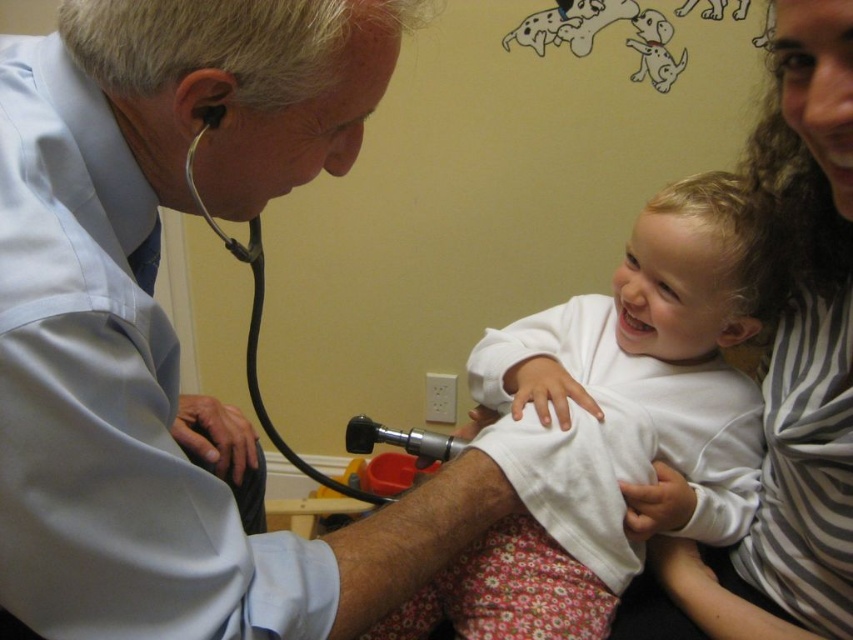
Question: Which point appears closest to the camera in this image?

Choices:
 (A) (840, 385)
 (B) (392, 432)

Answer: (A)

Question: Which of these objects is positioned farthest from the white matte shirt at center?

Choices:
 (A) metallic black stethoscope at left
 (B) striped fabric at upper right

Answer: (A)

Question: Can you confirm if white matte shirt at center is positioned above metallic black stethoscope at left?

Choices:
 (A) no
 (B) yes

Answer: (B)

Question: Which point appears farthest from the camera in this image?

Choices:
 (A) (743, 289)
 (B) (256, 356)
 (C) (828, 561)

Answer: (B)

Question: Is white matte shirt at center below metallic black stethoscope at left?

Choices:
 (A) yes
 (B) no

Answer: (B)

Question: In this image, where is white matte shirt at center located relative to metallic black stethoscope at left?

Choices:
 (A) above
 (B) below

Answer: (A)